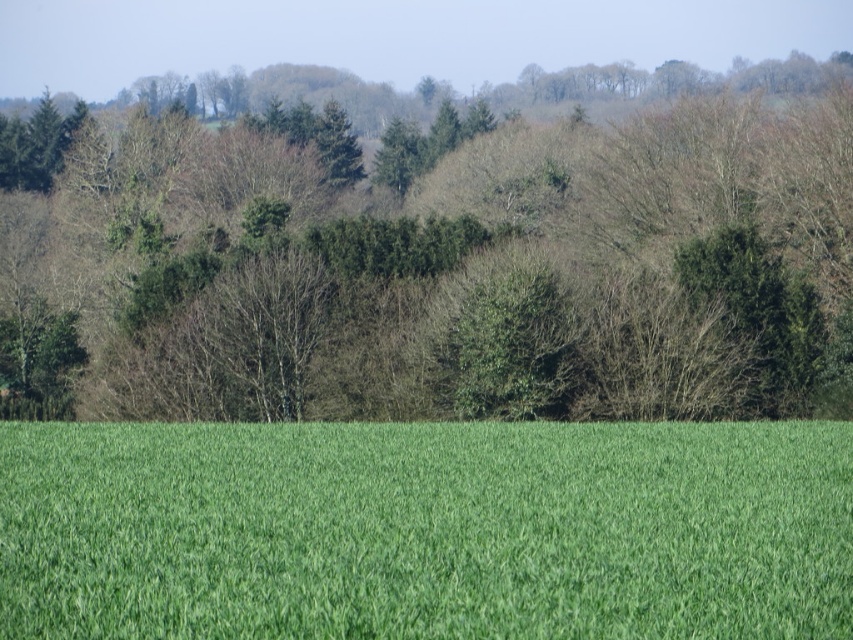
Who is more forward, [67,276] or [341,540]?

Point [341,540] is in front.

At what (x,y) coordinates should I click in order to perform the action: click on green leafy trees at center. Please return your answer as a coordinate pair (x, y). Looking at the image, I should click on (447, 262).

This screenshot has width=853, height=640. Find the location of `green leafy trees at center`. green leafy trees at center is located at coordinates [447, 262].